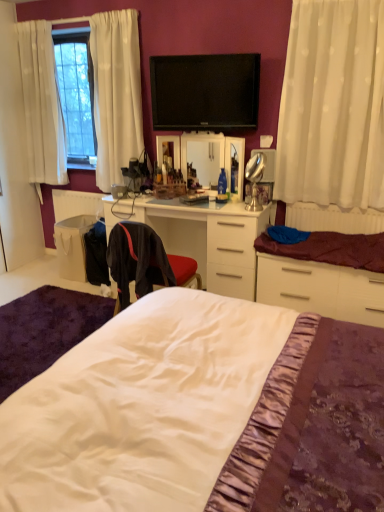
Locate an element on the screen. The image size is (384, 512). free space to the left of silver metallic table lamp at center is located at coordinates (235, 209).